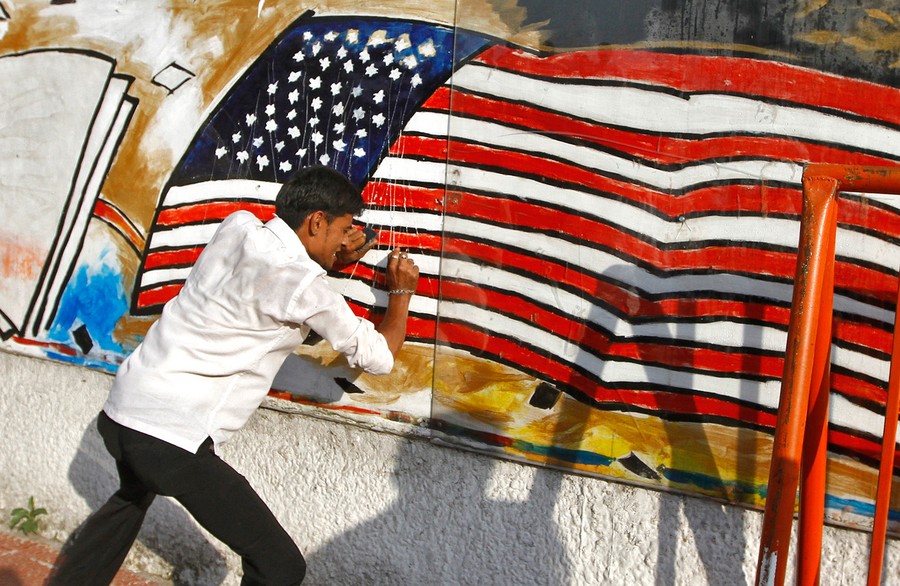
At what (x,y) coordinates should I click in order to perform the action: click on sunlight hitting wall. Please return your answer as a coordinate pair (x, y). This screenshot has height=586, width=900. Looking at the image, I should click on (298, 479).